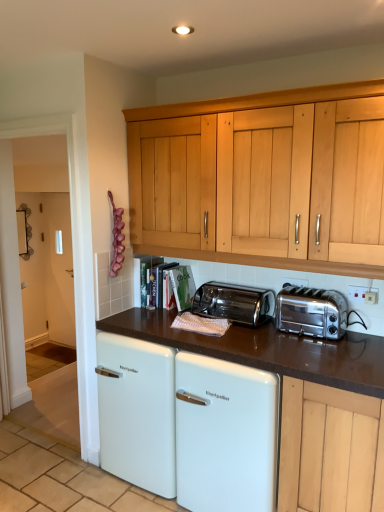
Question: Considering the relative sizes of white plastic electrical outlet at upper right, which ranks as the second electric outlet in left-to-right order, and transparent glass door at left in the image provided, is white plastic electrical outlet at upper right, which ranks as the second electric outlet in left-to-right order, thinner than transparent glass door at left?

Choices:
 (A) no
 (B) yes

Answer: (B)

Question: Is white plastic electrical outlet at upper right, which is the first electric outlet in right-to-left order, wider than transparent glass door at left?

Choices:
 (A) no
 (B) yes

Answer: (A)

Question: Is white plastic electrical outlet at upper right, which is the first electric outlet in right-to-left order, not near transparent glass door at left?

Choices:
 (A) yes
 (B) no

Answer: (A)

Question: Is white plastic electrical outlet at upper right, which ranks as the second electric outlet in left-to-right order, beside transparent glass door at left?

Choices:
 (A) no
 (B) yes

Answer: (A)

Question: Is white plastic electrical outlet at upper right, which ranks as the second electric outlet in left-to-right order, positioned in front of transparent glass door at left?

Choices:
 (A) yes
 (B) no

Answer: (A)

Question: Choose the correct answer: Is white glossy refrigerator at center inside white plastic electrical outlet at upper right, which is the first electric outlet in right-to-left order, or outside it?

Choices:
 (A) inside
 (B) outside

Answer: (B)

Question: From a real-world perspective, is white glossy refrigerator at center physically located above or below white plastic electrical outlet at upper right, which appears as the second electric outlet when viewed from the back?

Choices:
 (A) above
 (B) below

Answer: (B)

Question: From the image's perspective, is white glossy refrigerator at center above or below white plastic electrical outlet at upper right, which appears as the second electric outlet when viewed from the back?

Choices:
 (A) below
 (B) above

Answer: (A)

Question: Considering the positions of point (243, 444) and point (354, 295), is point (243, 444) closer or farther from the camera than point (354, 295)?

Choices:
 (A) farther
 (B) closer

Answer: (B)

Question: Considering their positions, is polished stainless steel toaster at center, placed as the first toaster when sorted from left to right, located in front of or behind white enamel refrigerator at center?

Choices:
 (A) front
 (B) behind

Answer: (B)

Question: From a real-world perspective, relative to white enamel refrigerator at center, is polished stainless steel toaster at center, placed as the 2th toaster when sorted from right to left, vertically above or below?

Choices:
 (A) above
 (B) below

Answer: (A)

Question: Based on their positions, is polished stainless steel toaster at center, placed as the first toaster when sorted from left to right, located to the left or right of white enamel refrigerator at center?

Choices:
 (A) left
 (B) right

Answer: (A)

Question: Considering the positions of point (269, 300) and point (357, 356), is point (269, 300) closer or farther from the camera than point (357, 356)?

Choices:
 (A) farther
 (B) closer

Answer: (A)

Question: Is white enamel refrigerator at center inside the boundaries of silver metallic electric outlet at upper right, which is the 1th electric outlet from back to front, or outside?

Choices:
 (A) outside
 (B) inside

Answer: (A)

Question: Visually, is white enamel refrigerator at center positioned to the left or to the right of silver metallic electric outlet at upper right, placed as the second electric outlet when sorted from right to left?

Choices:
 (A) left
 (B) right

Answer: (A)